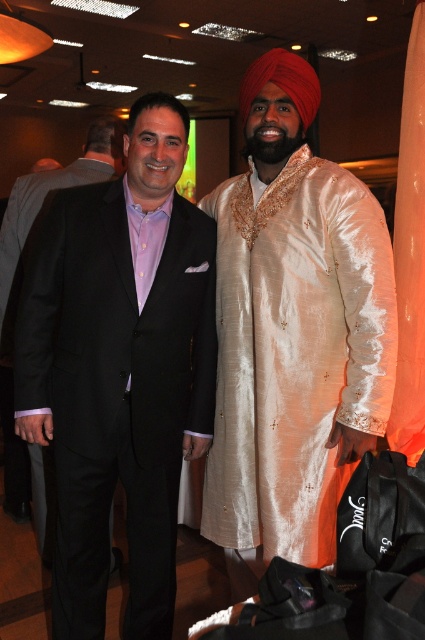
You are a photographer at a formal event. You want to capture a photo of both the black satin suit at left and the silky cream kurta at center without any obstructions. Based on their positions, which one should you adjust to move forward so that both are clearly visible in the photo?

The black satin suit at left is already in front of the silky cream kurta at center. To ensure both are visible without obstruction, the silky cream kurta at center should move forward so it is not blocked by the black satin suit at left.